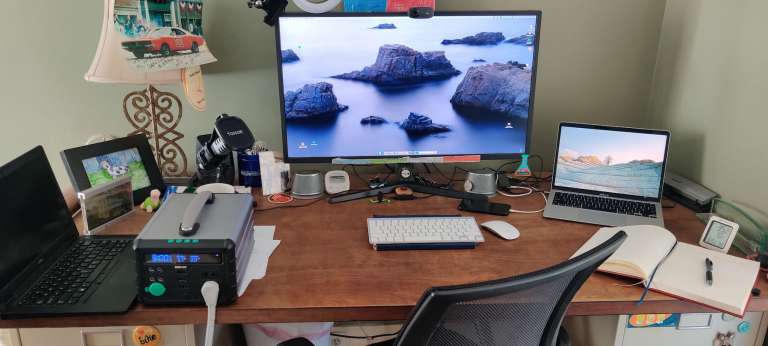
This screenshot has height=346, width=768. Find the location of `wireless apple mouse`. wireless apple mouse is located at coordinates (501, 230).